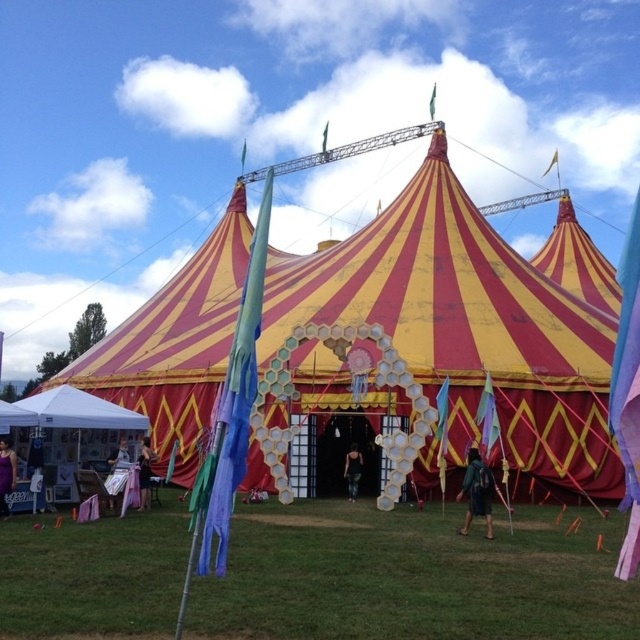
Based on the photo, you are planning to set up a small picnic blanket in the area where you see the green grass at lower center and the metallic silver chair at lower left. Based on their sizes, which object provides more space for placing the blanket?

The green grass at lower center might be wider than the metallic silver chair at lower left, so it likely offers more space for placing the picnic blanket.

You are standing outside the circus tent and notice the green grass at lower center and the black fabric dress at center. Which object is shorter in height?

The green grass at lower center is shorter in height compared to the black fabric dress at center.